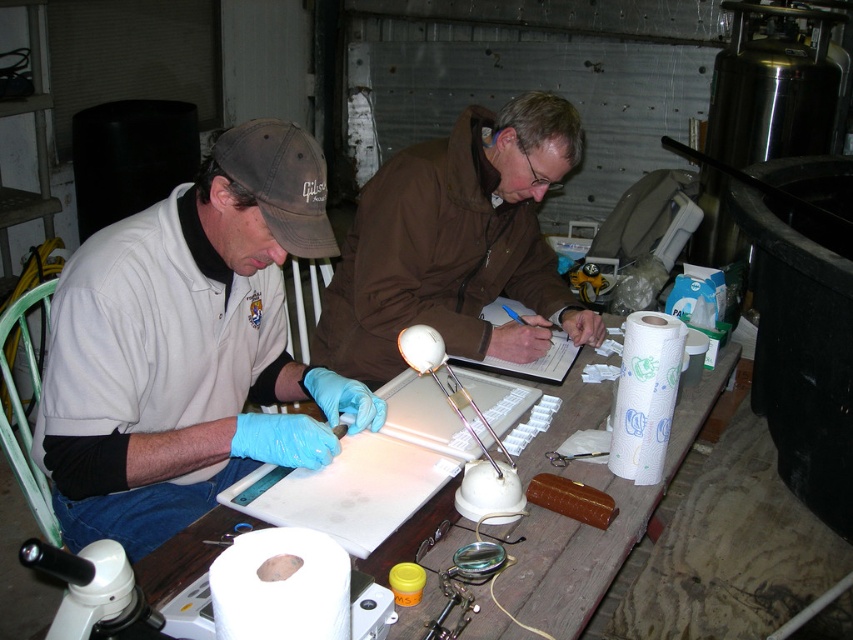
Question: Is blue latex gloves at left further to camera compared to white plastic table at center?

Choices:
 (A) yes
 (B) no

Answer: (A)

Question: In this image, where is blue latex gloves at left located relative to brown matte jacket at center?

Choices:
 (A) left
 (B) right

Answer: (A)

Question: Which object is positioned farthest from the white plastic table at center?

Choices:
 (A) blue latex gloves at left
 (B) brown matte jacket at center

Answer: (B)

Question: Which point appears closest to the camera in this image?

Choices:
 (A) (126, 456)
 (B) (511, 592)
 (C) (546, 342)

Answer: (B)

Question: From the image, what is the correct spatial relationship of brown matte jacket at center in relation to white plastic table at center?

Choices:
 (A) right
 (B) left

Answer: (B)

Question: Which object is farther from the camera taking this photo?

Choices:
 (A) white plastic table at center
 (B) blue latex gloves at left
 (C) brown matte jacket at center

Answer: (C)